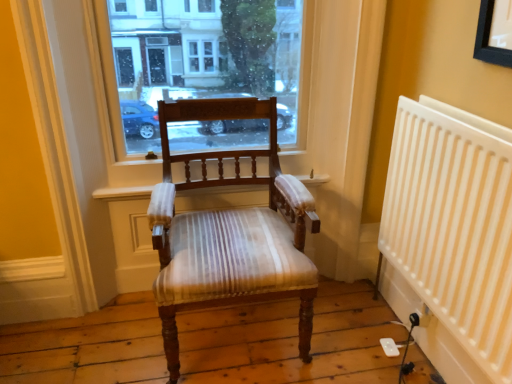
Question: From a real-world perspective, is white plastic radiator at right above or below wooden chair with striped upholstery at center?

Choices:
 (A) below
 (B) above

Answer: (B)

Question: Relative to wooden chair with striped upholstery at center, is white plastic radiator at right in front or behind?

Choices:
 (A) behind
 (B) front

Answer: (B)

Question: Based on their relative distances, which object is nearer to the wooden chair with striped upholstery at center?

Choices:
 (A) transparent glass window at center
 (B) white plastic radiator at right

Answer: (A)

Question: Estimate the real-world distances between objects in this image. Which object is farther from the white plastic radiator at right?

Choices:
 (A) wooden chair with striped upholstery at center
 (B) transparent glass window at center

Answer: (B)